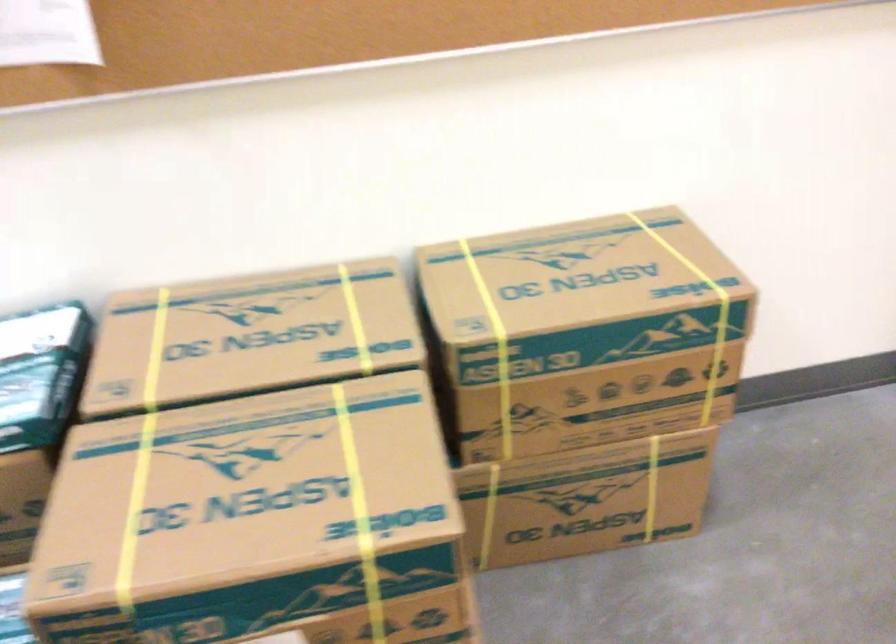
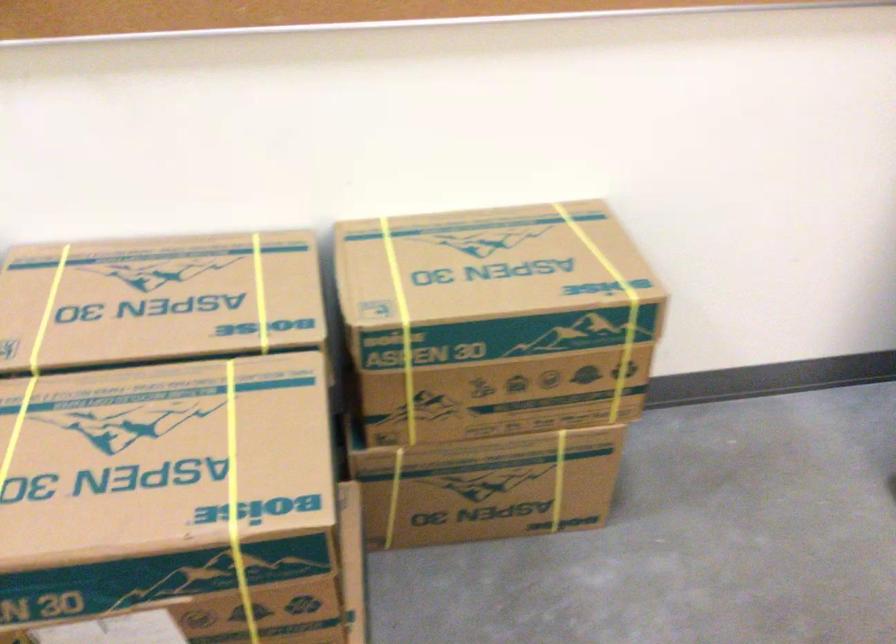
Where in the second image is the point corresponding to point 153,352 from the first image?

(47, 310)